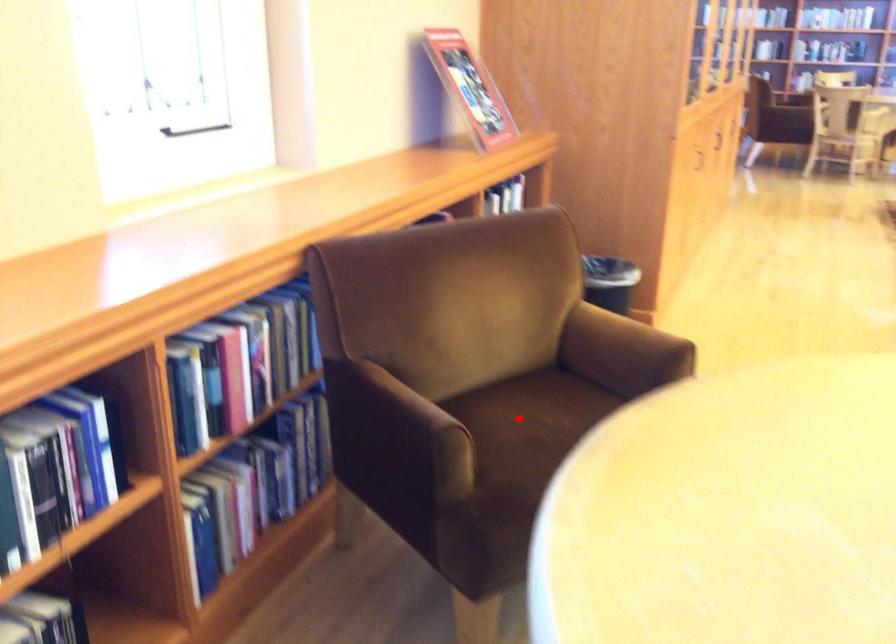
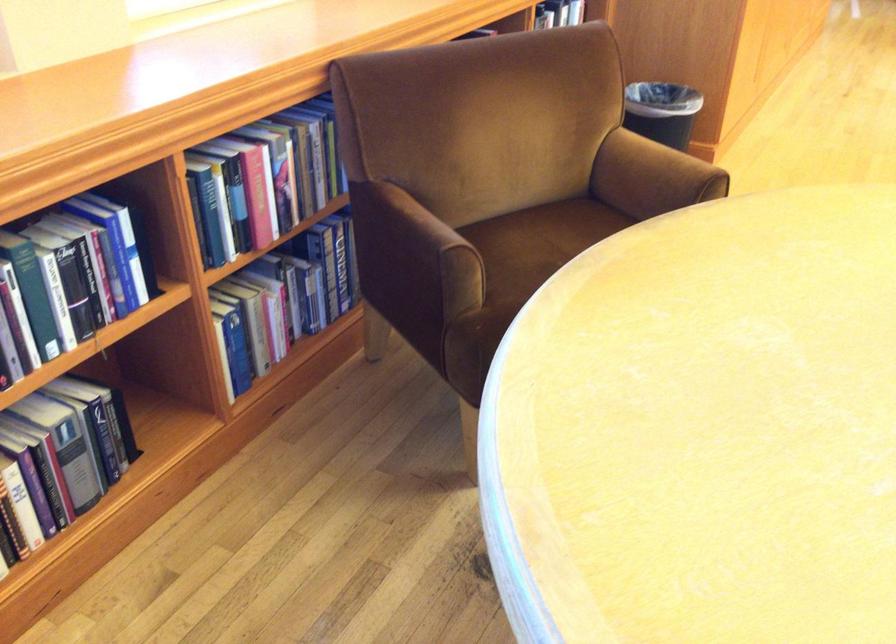
Where in the second image is the point corresponding to the highlighted location from the first image?

(538, 242)